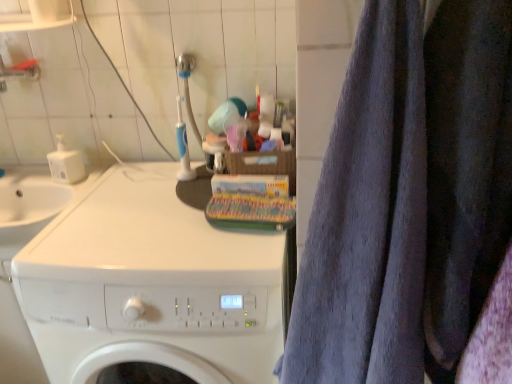
Locate an element on the screen. free space above white glossy washing machine at center (from a real-world perspective) is located at coordinates (158, 215).